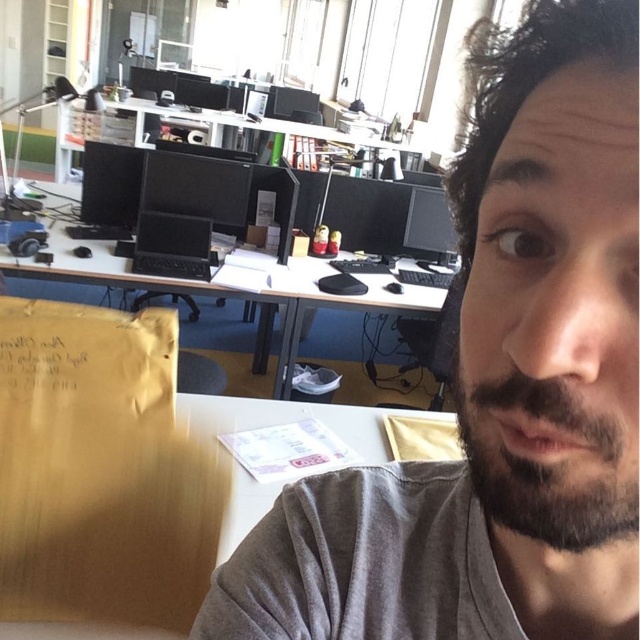
Question: Which point is farther to the camera?

Choices:
 (A) (493, 618)
 (B) (424, 138)

Answer: (B)

Question: Is dark brown fuzzy beard at lower right to the right of matte black computer desk at center from the viewer's perspective?

Choices:
 (A) yes
 (B) no

Answer: (A)

Question: Is dark brown fuzzy beard at lower right above matte black computer desk at center?

Choices:
 (A) yes
 (B) no

Answer: (B)

Question: Which object appears farthest from the camera in this image?

Choices:
 (A) dark brown fuzzy beard at lower right
 (B) wooden at center

Answer: (B)

Question: Is the position of gray matte shirt at center more distant than that of wooden at center?

Choices:
 (A) no
 (B) yes

Answer: (A)

Question: Which object is positioned closest to the matte black computer desk at center?

Choices:
 (A) dark brown fuzzy beard at lower right
 (B) wooden at center

Answer: (B)